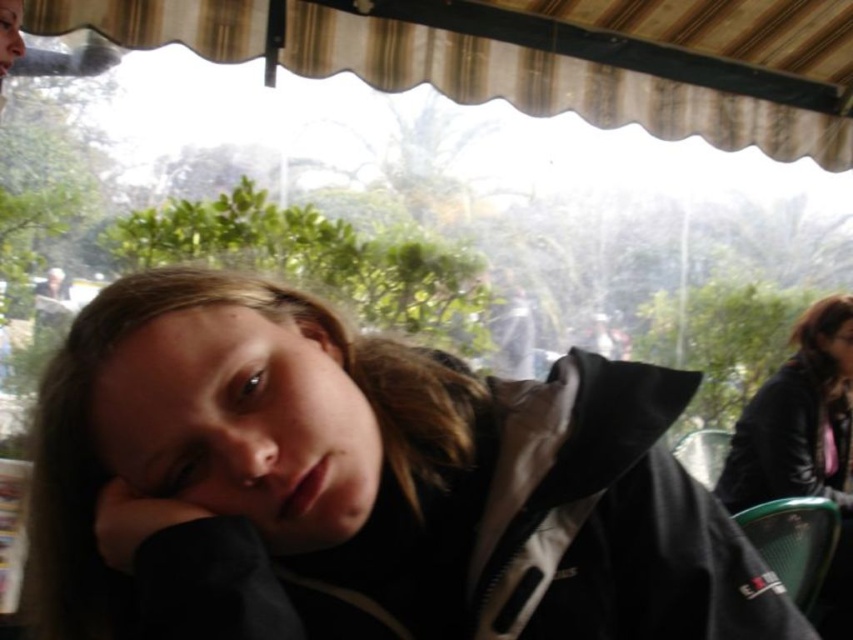
You are a customer sitting at a table in the cafe. You want to look at the black leather jacket at upper right and then the beige fabric canopy at upper center. Which object will you need to look towards first without moving your head?

You will need to look towards the beige fabric canopy at upper center first because it is closer to you than the black leather jacket at upper right, so it would be in your line of sight before the jacket.

You are designing a layout for a virtual reality game scene based on this image. The game requires placing a virtual object at the exact center of the image. Considering the position of the black matte jacket at center, can you determine if the jacket is positioned at the center of the image?

The black matte jacket at center is located at point (x=363, y=486), which is not the exact center of the image. The exact center would be at coordinates (x=426, y=320). Therefore, the jacket is not positioned at the center of the image.

You are a photographer trying to capture the black matte jacket at center in your shot. Your camera is 16.88 inches away from the jacket. Can you confirm if the jacket is within the camera lens focal length of 18 inches?

The black matte jacket at center and camera are 16.88 inches apart. Since the distance is less than the camera lens focal length of 18 inches, the jacket is within the focal range and can be captured clearly.